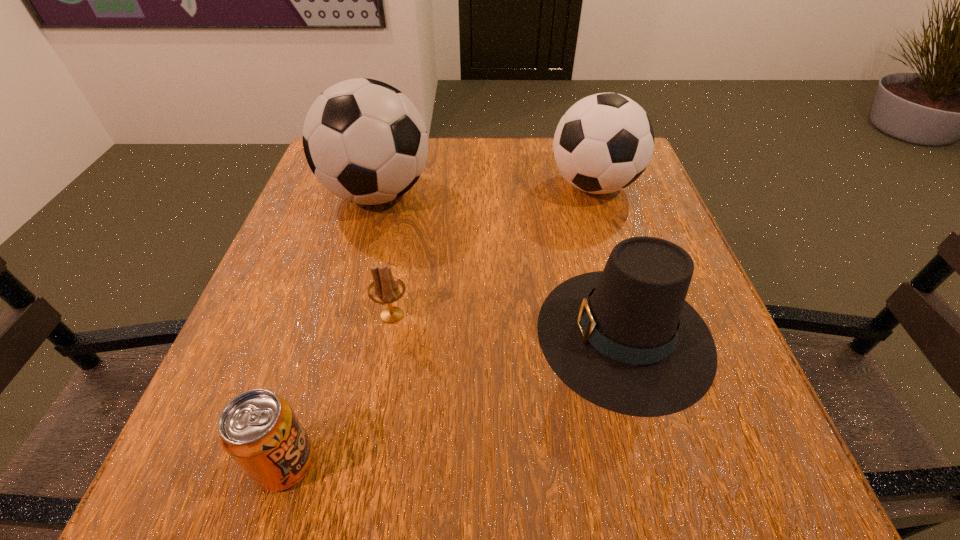
This screenshot has width=960, height=540. What are the coordinates of `object at the far right corner` in the screenshot? It's located at (604, 142).

You are a GUI agent. You are given a task and a screenshot of the screen. Output one action in this format:
    pyautogui.click(x=<x>, y=<y>)
    Task: Click on the free space at the far edge of the desktop
    
    Given the screenshot: What is the action you would take?
    pyautogui.click(x=430, y=141)

Find the location of a particular element. The height and width of the screenshot is (540, 960). vacant space at the left edge of the desktop is located at coordinates (257, 316).

Locate an element on the screen. This screenshot has width=960, height=540. vacant space at the right edge of the desktop is located at coordinates click(x=705, y=314).

Locate an element on the screen. free space between the third shortest object and the nearest object is located at coordinates (455, 399).

I want to click on free space between the shorter soccer ball and the candle holder, so click(x=492, y=251).

The image size is (960, 540). What are the coordinates of `free space between the hat and the taller soccer ball` in the screenshot? It's located at (501, 264).

I want to click on free space between the candle holder and the shorter soccer ball, so click(x=492, y=251).

The image size is (960, 540). In order to click on free space between the tallest object and the soda can in this screenshot , I will do `click(331, 328)`.

The height and width of the screenshot is (540, 960). In order to click on vacant region between the third shortest object and the soda can in this screenshot , I will do `click(455, 399)`.